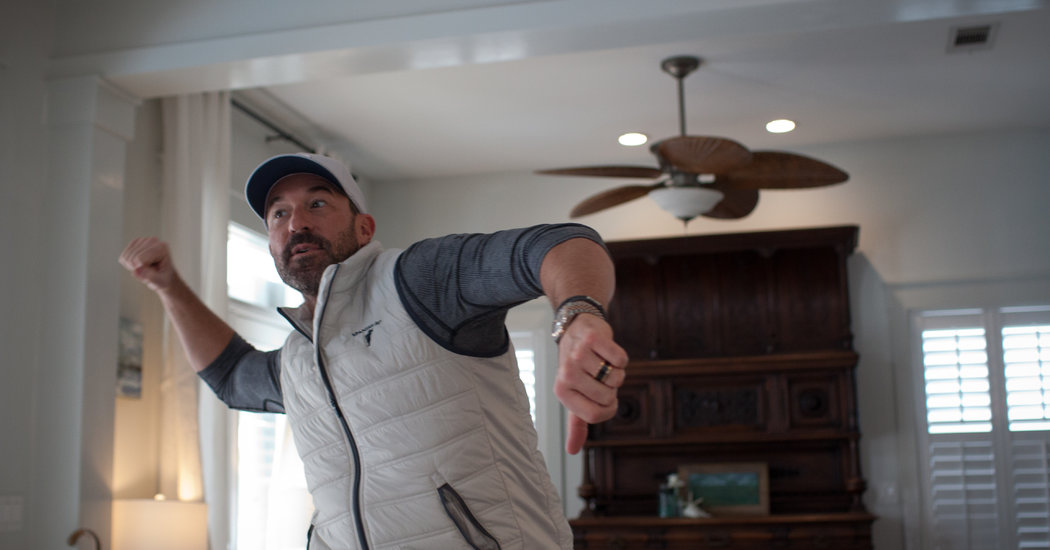
The width and height of the screenshot is (1050, 550). Find the location of `white frame`. white frame is located at coordinates (375, 46), (81, 278).